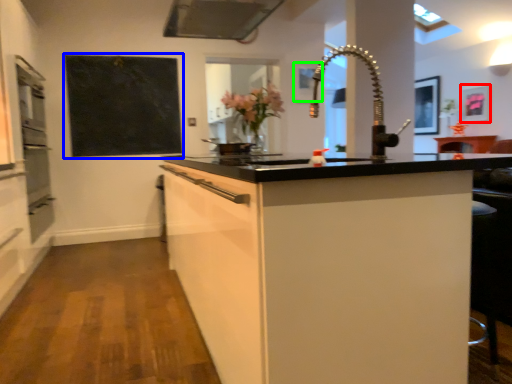
Question: Which object is positioned farthest from picture frame (highlighted by a red box)? Select from bulletin board (highlighted by a blue box) and picture frame (highlighted by a green box).

Choices:
 (A) bulletin board
 (B) picture frame

Answer: (A)